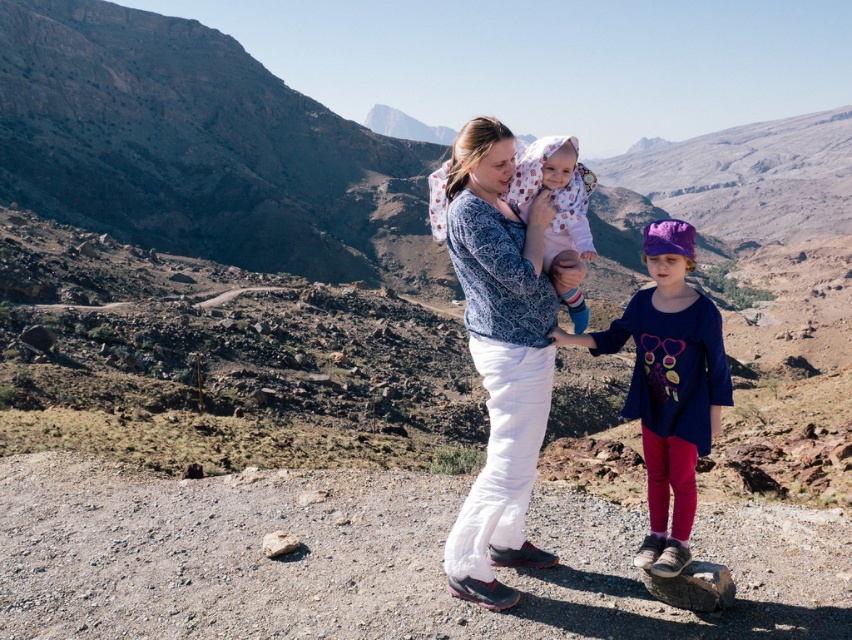
Question: Considering the real-world distances, which object is closest to the blue cotton shirt at center?

Choices:
 (A) blue patterned sweater at center
 (B) fluffy pink blanket at center

Answer: (A)

Question: Which point is closer to the camera taking this photo?

Choices:
 (A) (525, 458)
 (B) (565, 168)

Answer: (A)

Question: Which point is farther to the camera?

Choices:
 (A) blue cotton shirt at center
 (B) blue patterned sweater at center
 (C) fluffy pink blanket at center

Answer: (C)

Question: Is blue cotton shirt at center positioned behind fluffy pink blanket at center?

Choices:
 (A) yes
 (B) no

Answer: (B)

Question: Does blue patterned sweater at center lie in front of blue cotton shirt at center?

Choices:
 (A) yes
 (B) no

Answer: (A)

Question: Is blue patterned sweater at center to the right of fluffy pink blanket at center from the viewer's perspective?

Choices:
 (A) no
 (B) yes

Answer: (A)